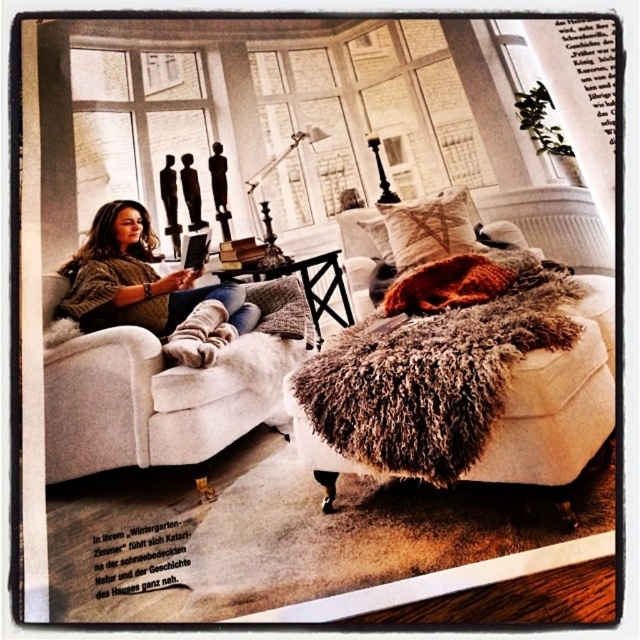
Does beige fabric couch at center appear on the right side of textured beige pillow at center?

In fact, beige fabric couch at center is to the left of textured beige pillow at center.

Between beige fabric couch at center and textured beige pillow at center, which one appears on the right side from the viewer's perspective?

textured beige pillow at center

Image resolution: width=640 pixels, height=640 pixels. What are the coordinates of `beige fabric couch at center` in the screenshot? It's located at (166, 390).

Which is above, fuzzy fabric ottoman at center or textured beige pillow at center?

textured beige pillow at center is higher up.

Who is more forward, (422, 225) or (289, 296)?

Point (422, 225) is more forward.

You are a GUI agent. You are given a task and a screenshot of the screen. Output one action in this format:
    pyautogui.click(x=<x>, y=<y>)
    Task: Click on the fuzzy fabric ottoman at center
    Image resolution: width=640 pixels, height=640 pixels.
    Given the screenshot: What is the action you would take?
    pyautogui.click(x=461, y=365)

Can you confirm if textured beige pillow at upper right is smaller than textured beige pillow at center?

Incorrect, textured beige pillow at upper right is not smaller in size than textured beige pillow at center.

This screenshot has height=640, width=640. Identify the location of textured beige pillow at upper right. (429, 227).